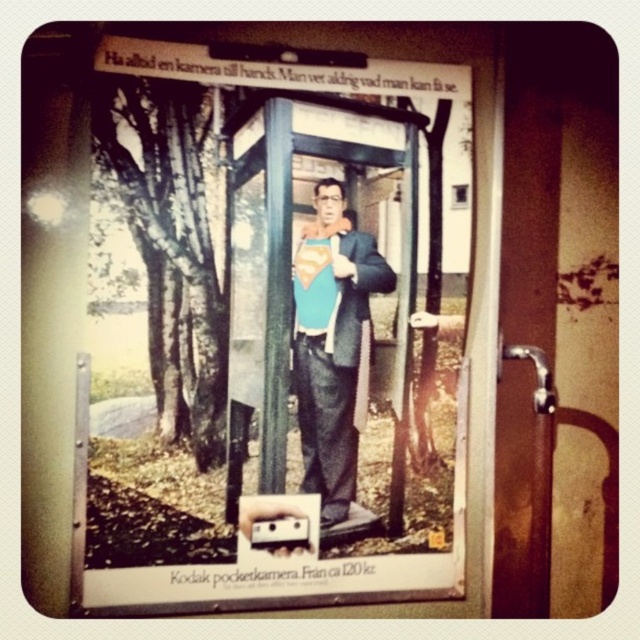
Consider the image. Does matte blue suit at center appear on the right side of blue fabric superman suit at center?

In fact, matte blue suit at center is to the left of blue fabric superman suit at center.

Does matte blue suit at center have a larger size compared to blue fabric superman suit at center?

Yes.

Is point (177, 104) behind point (349, 385)?

No, (177, 104) is closer to viewer.

This screenshot has height=640, width=640. In order to click on matte blue suit at center in this screenshot , I will do `click(269, 330)`.